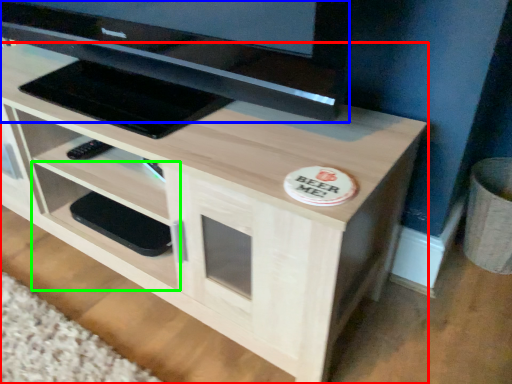
Question: Estimate the real-world distances between objects in this image. Which object is closer to desk (highlighted by a red box), television (highlighted by a blue box) or shelf (highlighted by a green box)?

Choices:
 (A) television
 (B) shelf

Answer: (B)